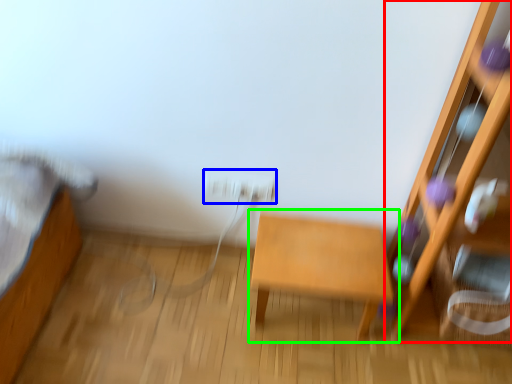
Question: Which is farther away from furniture (highlighted by a red box)? electric outlet (highlighted by a blue box) or table (highlighted by a green box)?

Choices:
 (A) electric outlet
 (B) table

Answer: (A)